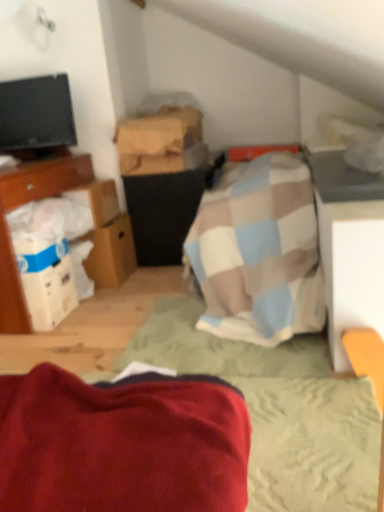
This screenshot has height=512, width=384. What do you see at coordinates (161, 142) in the screenshot? I see `brown cardboard box at upper center, the first cardboard box viewed from the top` at bounding box center [161, 142].

What is the approximate width of brown cardboard box at left, acting as the 2th cardboard box starting from the top?

4.70 inches.

What do you see at coordinates (106, 234) in the screenshot? This screenshot has height=512, width=384. I see `white cardboard box at center-left, which is counted as the 1th cardboard box, starting from the bottom` at bounding box center [106, 234].

In order to click on black matte vanity at center in this screenshot , I will do `click(164, 212)`.

Is white cardboard box at left turned away from black matte vanity at center?

white cardboard box at left does not have its back to black matte vanity at center.

Considering the relative positions of white cardboard box at left and black matte vanity at center in the image provided, is white cardboard box at left to the right of black matte vanity at center from the viewer's perspective?

No.

From a real-world perspective, between white cardboard box at left and black matte vanity at center, who is vertically higher?

black matte vanity at center is physically above.

Is white cardboard box at left positioned beyond the bounds of black matte vanity at center?

Yes, white cardboard box at left is not within black matte vanity at center.

Who is bigger, brown cardboard box at upper center, marked as the third cardboard box in a bottom-to-top arrangement, or black glossy tv at upper left?

black glossy tv at upper left.

Would you say brown cardboard box at upper center, marked as the third cardboard box in a bottom-to-top arrangement, is inside or outside black glossy tv at upper left?

brown cardboard box at upper center, marked as the third cardboard box in a bottom-to-top arrangement, is outside black glossy tv at upper left.

Where is `television above the brown cardboard box at upper center, marked as the third cardboard box in a bottom-to-top arrangement (from the image's perspective)`? television above the brown cardboard box at upper center, marked as the third cardboard box in a bottom-to-top arrangement (from the image's perspective) is located at coordinates (36, 117).

Who is bigger, white cardboard boxes at left or brown cardboard box at left, which is counted as the 2th cardboard box, starting from the bottom?

With larger size is white cardboard boxes at left.

Is point (3, 181) positioned in front of point (88, 197)?

Yes, point (3, 181) is closer to viewer.

Considering the relative sizes of white cardboard boxes at left and brown cardboard box at left, acting as the 2th cardboard box starting from the top, in the image provided, is white cardboard boxes at left wider than brown cardboard box at left, acting as the 2th cardboard box starting from the top,?

Correct, the width of white cardboard boxes at left exceeds that of brown cardboard box at left, acting as the 2th cardboard box starting from the top.

Does white cardboard boxes at left touch brown cardboard box at left, acting as the 2th cardboard box starting from the top?

No, white cardboard boxes at left is not next to brown cardboard box at left, acting as the 2th cardboard box starting from the top.

From a real-world perspective, between white cardboard box at center-left, positioned as the 3th cardboard box in top-to-bottom order, and brown cardboard box at upper center, the first cardboard box viewed from the top, who is vertically lower?

white cardboard box at center-left, positioned as the 3th cardboard box in top-to-bottom order.

Is white cardboard box at center-left, which is counted as the 1th cardboard box, starting from the bottom, looking in the opposite direction of brown cardboard box at upper center, the first cardboard box viewed from the top?

No, white cardboard box at center-left, which is counted as the 1th cardboard box, starting from the bottom,'s orientation is not away from brown cardboard box at upper center, the first cardboard box viewed from the top.

Based on the photo, are white cardboard box at center-left, positioned as the 3th cardboard box in top-to-bottom order, and brown cardboard box at upper center, marked as the third cardboard box in a bottom-to-top arrangement, far apart?

Actually, white cardboard box at center-left, positioned as the 3th cardboard box in top-to-bottom order, and brown cardboard box at upper center, marked as the third cardboard box in a bottom-to-top arrangement, are a little close together.

Between white cardboard box at center-left, positioned as the 3th cardboard box in top-to-bottom order, and brown cardboard box at upper center, marked as the third cardboard box in a bottom-to-top arrangement, which one has smaller width?

Thinner between the two is white cardboard box at center-left, positioned as the 3th cardboard box in top-to-bottom order.

In terms of width, does black glossy tv at upper left look wider or thinner when compared to brown cardboard box at left, acting as the 2th cardboard box starting from the top?

black glossy tv at upper left is wider than brown cardboard box at left, acting as the 2th cardboard box starting from the top.

Relative to brown cardboard box at left, which is counted as the 2th cardboard box, starting from the bottom, is black glossy tv at upper left in front or behind?

In the image, black glossy tv at upper left appears behind brown cardboard box at left, which is counted as the 2th cardboard box, starting from the bottom.

How many degrees apart are the facing directions of black glossy tv at upper left and brown cardboard box at left, acting as the 2th cardboard box starting from the top?

The angle between the facing direction of black glossy tv at upper left and the facing direction of brown cardboard box at left, acting as the 2th cardboard box starting from the top, is 3.4 degrees.

Could you tell me if black glossy tv at upper left is facing brown cardboard box at left, acting as the 2th cardboard box starting from the top?

No, black glossy tv at upper left is not aimed at brown cardboard box at left, acting as the 2th cardboard box starting from the top.

Is brown cardboard box at left, which is counted as the 2th cardboard box, starting from the bottom, taller than velvety red blanket at lower left?

Yes, brown cardboard box at left, which is counted as the 2th cardboard box, starting from the bottom, is taller than velvety red blanket at lower left.

Do you think brown cardboard box at left, which is counted as the 2th cardboard box, starting from the bottom, is within velvety red blanket at lower left, or outside of it?

brown cardboard box at left, which is counted as the 2th cardboard box, starting from the bottom, is outside velvety red blanket at lower left.

Could you tell me if brown cardboard box at left, acting as the 2th cardboard box starting from the top, is facing velvety red blanket at lower left?

No, brown cardboard box at left, acting as the 2th cardboard box starting from the top, is not aimed at velvety red blanket at lower left.

Measure the distance between black matte vanity at center and black glossy tv at upper left.

black matte vanity at center and black glossy tv at upper left are 64.17 centimeters apart from each other.

Which is in front, point (167, 185) or point (22, 91)?

Point (22, 91)

From a real-world perspective, is black matte vanity at center located higher than black glossy tv at upper left?

No, from a real-world perspective, black matte vanity at center is not over black glossy tv at upper left

Where is `box below the black matte vanity at center (from the image's perspective)`? Image resolution: width=384 pixels, height=512 pixels. box below the black matte vanity at center (from the image's perspective) is located at coordinates click(50, 294).

The width and height of the screenshot is (384, 512). I want to click on television located above the brown cardboard box at upper center, marked as the third cardboard box in a bottom-to-top arrangement (from a real-world perspective), so click(x=36, y=117).

Considering their positions, is wooden bed frame at center positioned further to white cardboard boxes at left than black matte vanity at center?

wooden bed frame at center.

Based on their spatial positions, is brown cardboard box at upper center, the first cardboard box viewed from the top, or white cardboard box at left further from white cardboard boxes at left?

brown cardboard box at upper center, the first cardboard box viewed from the top.

When comparing their distances from black glossy tv at upper left, does brown cardboard box at left, acting as the 2th cardboard box starting from the top, or white cardboard box at left seem closer?

The object closer to black glossy tv at upper left is brown cardboard box at left, acting as the 2th cardboard box starting from the top.

Considering their positions, is black matte vanity at center positioned further to white cardboard boxes at left than wooden bed frame at center?

wooden bed frame at center is positioned further to the anchor white cardboard boxes at left.

Considering their positions, is white cardboard box at center-left, which is counted as the 1th cardboard box, starting from the bottom, positioned further to wooden bed frame at center than brown cardboard box at upper center, the first cardboard box viewed from the top?

brown cardboard box at upper center, the first cardboard box viewed from the top, is further to wooden bed frame at center.

Which object lies further to the anchor point white cardboard box at center-left, positioned as the 3th cardboard box in top-to-bottom order, black glossy tv at upper left or white cardboard box at left?

The object further to white cardboard box at center-left, positioned as the 3th cardboard box in top-to-bottom order, is black glossy tv at upper left.

Estimate the real-world distances between objects in this image. Which object is further from white cardboard boxes at left, brown cardboard box at upper center, the first cardboard box viewed from the top, or brown cardboard box at left, acting as the 2th cardboard box starting from the top?

Based on the image, brown cardboard box at upper center, the first cardboard box viewed from the top, appears to be further to white cardboard boxes at left.

Considering their positions, is white cardboard box at left positioned further to white cardboard boxes at left than black matte vanity at center?

black matte vanity at center is further to white cardboard boxes at left.

Find the location of a particular element. This screenshot has height=512, width=384. bed between wooden bed frame at center and brown cardboard box at left, which is counted as the 2th cardboard box, starting from the bottom, from front to back is located at coordinates (122, 443).

Identify the location of cabinetry located between velvety red blanket at lower left and brown cardboard box at upper center, marked as the third cardboard box in a bottom-to-top arrangement, in the depth direction. This screenshot has width=384, height=512. (24, 203).

This screenshot has height=512, width=384. Find the location of `box between wooden bed frame at center and black glossy tv at upper left along the z-axis`. box between wooden bed frame at center and black glossy tv at upper left along the z-axis is located at coordinates (50, 294).

At what (x,y) coordinates should I click in order to perform the action: click on cabinetry located between wooden bed frame at center and black glossy tv at upper left in the depth direction. Please return your answer as a coordinate pair (x, y). Image resolution: width=384 pixels, height=512 pixels. Looking at the image, I should click on (24, 203).